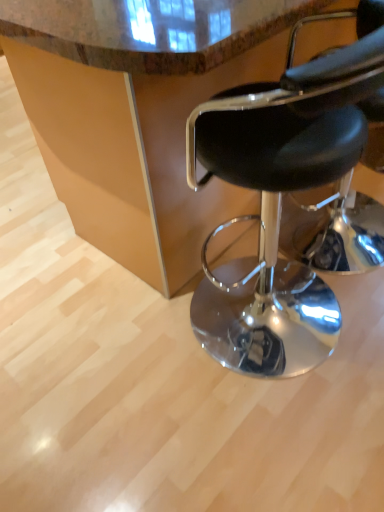
Question: Considering the relative sizes of black leather stool at right and marble countertop at center in the image provided, is black leather stool at right shorter than marble countertop at center?

Choices:
 (A) yes
 (B) no

Answer: (A)

Question: Does black leather stool at right come behind marble countertop at center?

Choices:
 (A) yes
 (B) no

Answer: (B)

Question: Is the depth of black leather stool at right less than that of marble countertop at center?

Choices:
 (A) no
 (B) yes

Answer: (B)

Question: Are black leather stool at right and marble countertop at center far apart?

Choices:
 (A) yes
 (B) no

Answer: (B)

Question: Is marble countertop at center surrounded by black leather stool at right?

Choices:
 (A) yes
 (B) no

Answer: (B)

Question: From the image's perspective, is black leather stool at right over marble countertop at center?

Choices:
 (A) no
 (B) yes

Answer: (A)

Question: Is marble countertop at center looking in the opposite direction of black leather stool at right?

Choices:
 (A) no
 (B) yes

Answer: (B)

Question: Considering the relative sizes of marble countertop at center and black leather stool at right in the image provided, is marble countertop at center smaller than black leather stool at right?

Choices:
 (A) yes
 (B) no

Answer: (B)

Question: Is marble countertop at center in contact with black leather stool at right?

Choices:
 (A) no
 (B) yes

Answer: (A)

Question: From a real-world perspective, is marble countertop at center physically above black leather stool at right?

Choices:
 (A) yes
 (B) no

Answer: (B)

Question: Considering the relative sizes of marble countertop at center and black leather stool at right in the image provided, is marble countertop at center wider than black leather stool at right?

Choices:
 (A) no
 (B) yes

Answer: (B)

Question: Considering the relative positions of marble countertop at center and black leather stool at right in the image provided, is marble countertop at center to the right of black leather stool at right from the viewer's perspective?

Choices:
 (A) yes
 (B) no

Answer: (A)

Question: Considering their positions, is black leather stool at right located in front of or behind marble countertop at center?

Choices:
 (A) behind
 (B) front

Answer: (B)